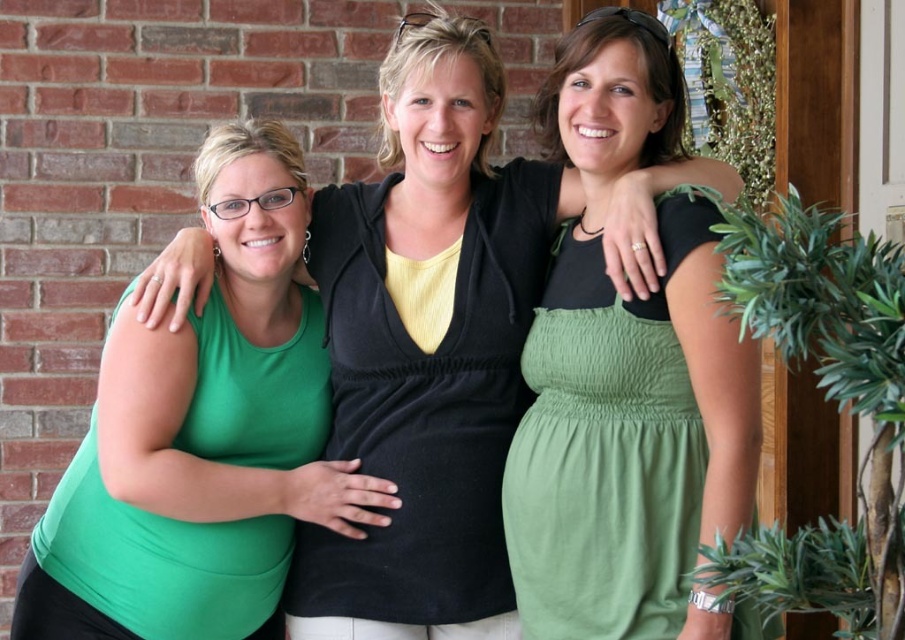
Question: Is green cotton dress at center behind green matte dress at left?

Choices:
 (A) no
 (B) yes

Answer: (A)

Question: Which point is farther to the camera?

Choices:
 (A) green matte dress at left
 (B) matte black top at center
 (C) matte black dress at center

Answer: (A)

Question: Can you confirm if matte black top at center is positioned to the left of green cotton dress at center?

Choices:
 (A) no
 (B) yes

Answer: (B)

Question: Which point is closer to the camera?

Choices:
 (A) (608, 241)
 (B) (338, 400)

Answer: (A)

Question: Which object is positioned closest to the matte black top at center?

Choices:
 (A) matte black dress at center
 (B) green matte dress at left

Answer: (A)

Question: Is matte black top at center smaller than green matte dress at left?

Choices:
 (A) yes
 (B) no

Answer: (B)